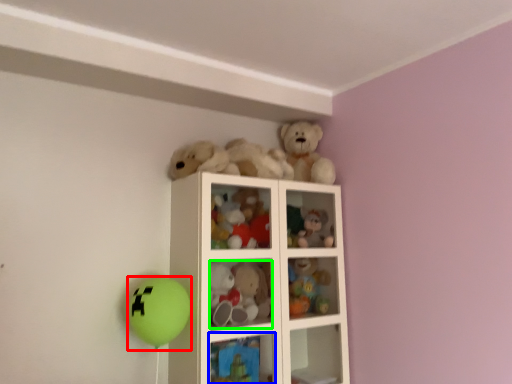
Question: Which object is the closest to the balloon (highlighted by a red box)? Choose among these: cabinet (highlighted by a blue box) or toy (highlighted by a green box).

Choices:
 (A) cabinet
 (B) toy

Answer: (B)